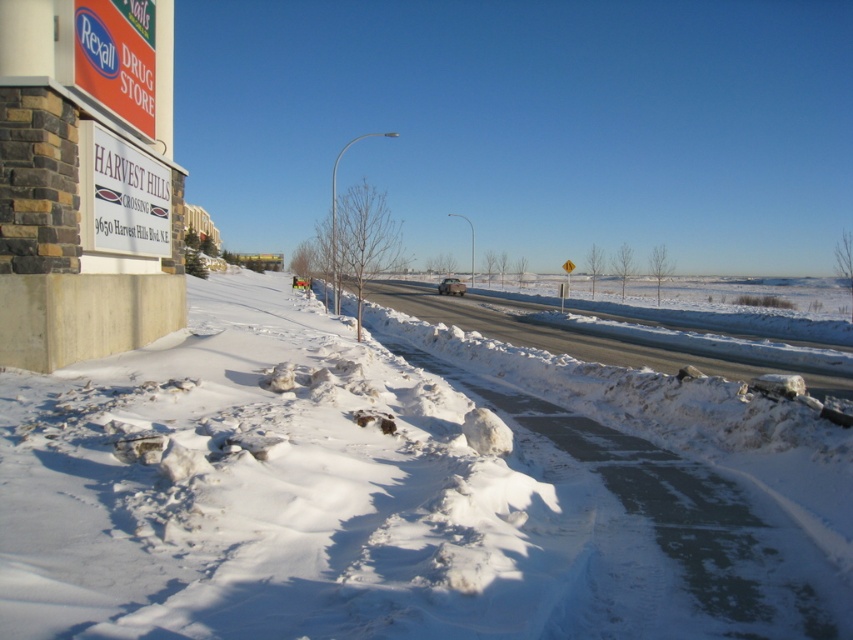
You are a delivery driver who needs to attach a new sign to the building. The new sign must be wider than the existing white plastic sign at upper left but narrower than the matte red sign at upper left. Can you determine if a 1.2 meter wide sign will fit appropriately?

The white plastic sign at upper left is narrower than the matte red sign at upper left. Since the new sign is 1.2 meters wide, it must be wider than the white plastic sign but narrower than the matte red sign. If the white plastic sign is less than 1.2 meters and the matte red sign is more than 1.2 meters, then yes. However, without exact measurements, we cannot confirm. But according to the description, the white plastic sign is less than the matte red one. Assuming 1.2 meters is between their widths, it

You are a delivery person trying to find the Rexall Drug Store at Harvest Hills Crossing. You see the white plastic sign at upper left and the white powdery snow at lower left. Which object is closer to the road?

The white powdery snow at lower left is closer to the road than the white plastic sign at upper left.

In the scene shown: You are a delivery driver who needs to turn left onto the road from the sidewalk. You see a white plastic sign at upper left and a metallic silver car at center. Which object is closer to the left side of the road?

The white plastic sign at upper left is to the left of metallic silver car at center, so it is closer to the left side of the road.